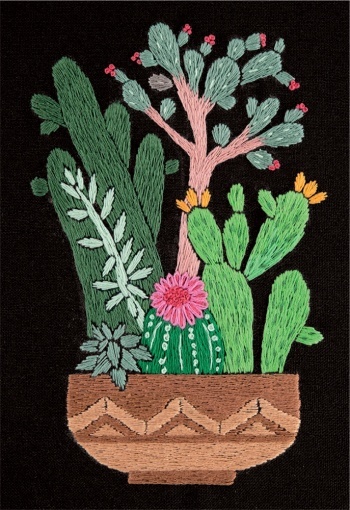
Locate an element on the screen. stitched art is located at coordinates (126, 22).